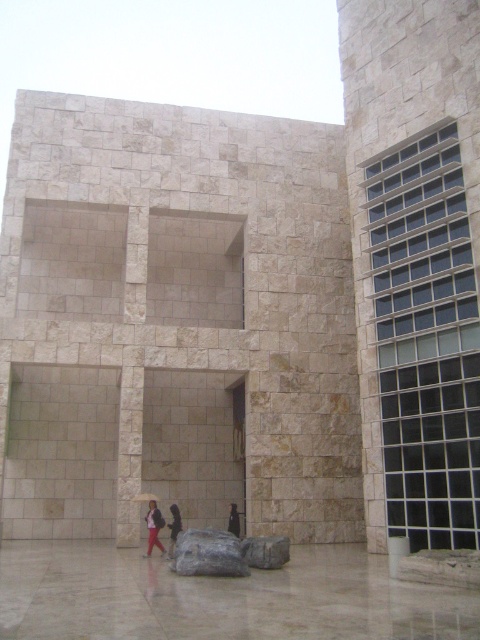
Who is more forward, (x=148, y=529) or (x=230, y=516)?

Point (x=148, y=529)

Is point (151, 550) in front of point (239, 513)?

Yes, point (151, 550) is in front of point (239, 513).

Where is `dark gray fabric umbrella at lower center`? This screenshot has width=480, height=640. dark gray fabric umbrella at lower center is located at coordinates (154, 528).

Which is in front, point (148, 545) or point (171, 552)?

Point (148, 545) is more forward.

Is dark gray fabric umbrella at lower center below dark fabric umbrella at lower center?

No.

This screenshot has width=480, height=640. What are the coordinates of `dark gray fabric umbrella at lower center` in the screenshot? It's located at pos(154,528).

Does gray rough stone at center lie in front of dark gray fabric jacket at center?

Yes.

Can you confirm if gray rough stone at center is bigger than dark gray fabric jacket at center?

Correct, gray rough stone at center is larger in size than dark gray fabric jacket at center.

Where is `gray rough stone at center`? Image resolution: width=480 pixels, height=640 pixels. gray rough stone at center is located at coordinates (265, 552).